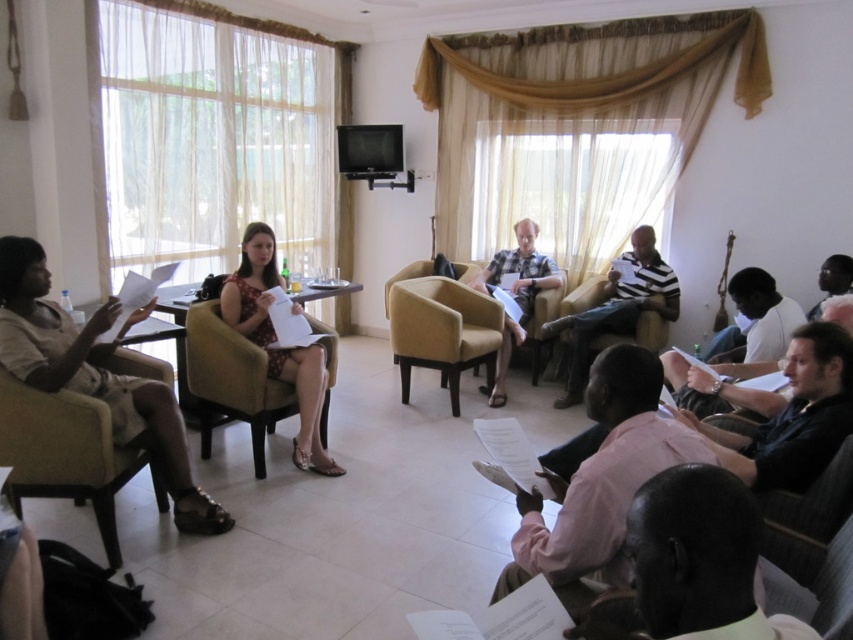
Consider the image. You are a photographer setting up for a group photo. You need to ensure that the beige fabric skirt at lower left and the plaid cotton shirt at center are both visible in the frame. Based on their positions, which one should you focus on first to ensure both are in the shot?

The beige fabric skirt at lower left is located below the plaid cotton shirt at center, so you should focus on the plaid cotton shirt at center first to ensure both are in the frame.

You are sitting in the velvet beige armchair at center and want to hand a document to the person wearing the plaid cotton shirt at center. Which direction should you move to reach them?

Since the velvet beige armchair at center is closer to the viewer than the plaid cotton shirt at center, you should move backward to reach the person wearing the plaid cotton shirt at center.